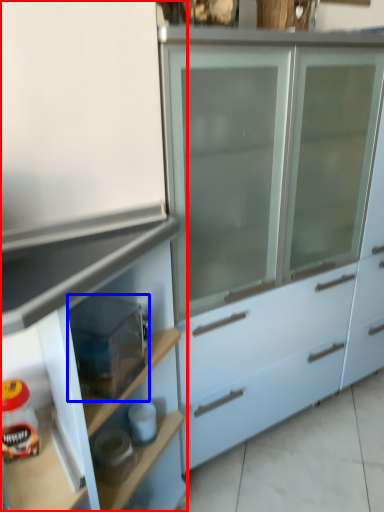
Question: Among these objects, which one is farthest to the camera, cabinetry (highlighted by a red box) or appliance (highlighted by a blue box)?

Choices:
 (A) cabinetry
 (B) appliance

Answer: (B)